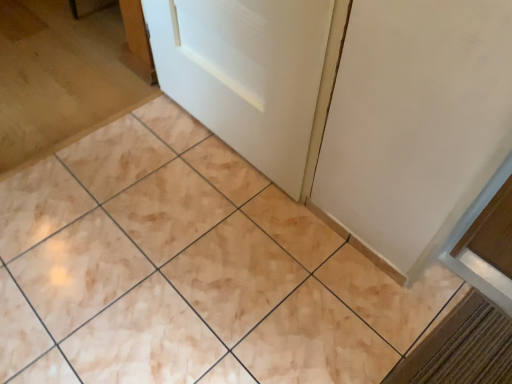
What is the approximate width of white glossy door at upper center?

The width of white glossy door at upper center is 3.68 inches.

Measure the distance between white glossy door at upper center and camera.

A distance of 38.03 inches exists between white glossy door at upper center and camera.

This screenshot has width=512, height=384. What do you see at coordinates (246, 73) in the screenshot?
I see `white glossy door at upper center` at bounding box center [246, 73].

Locate an element on the screen. white glossy door at upper center is located at coordinates (246, 73).

The image size is (512, 384). I want to click on beige marble tile at center, so click(x=188, y=270).

The image size is (512, 384). What do you see at coordinates (188, 270) in the screenshot? I see `beige marble tile at center` at bounding box center [188, 270].

Identify the location of white glossy door at upper center. This screenshot has height=384, width=512. (246, 73).

Between beige marble tile at center and white glossy door at upper center, which one appears on the right side from the viewer's perspective?

beige marble tile at center.

In the image, is beige marble tile at center positioned in front of or behind white glossy door at upper center?

beige marble tile at center is in front of white glossy door at upper center.

Considering the points (200, 266) and (272, 135), which point is in front, point (200, 266) or point (272, 135)?

The point (200, 266) is closer.

From the image's perspective, between beige marble tile at center and white glossy door at upper center, who is located below?

beige marble tile at center, from the image's perspective.

From a real-world perspective, which is physically above, beige marble tile at center or white glossy door at upper center?

white glossy door at upper center is physically above.

Between beige marble tile at center and white glossy door at upper center, which one has smaller width?

Thinner between the two is white glossy door at upper center.

Between beige marble tile at center and white glossy door at upper center, which one has less height?

Standing shorter between the two is beige marble tile at center.

Who is smaller, beige marble tile at center or white glossy door at upper center?

white glossy door at upper center is smaller.

Can white glossy door at upper center be found inside beige marble tile at center?

That's incorrect, white glossy door at upper center is not inside beige marble tile at center.

Is beige marble tile at center beside white glossy door at upper center?

No, beige marble tile at center is not touching white glossy door at upper center.

Is beige marble tile at center oriented away from white glossy door at upper center?

beige marble tile at center does not have its back to white glossy door at upper center.

The width and height of the screenshot is (512, 384). I want to click on door above the beige marble tile at center (from a real-world perspective), so click(246, 73).

Which is more to the left, white glossy door at upper center or beige marble tile at center?

From the viewer's perspective, white glossy door at upper center appears more on the left side.

Between white glossy door at upper center and beige marble tile at center, which one is positioned behind?

white glossy door at upper center is behind.

Does point (162, 75) come closer to viewer compared to point (48, 343)?

No, (162, 75) is further to viewer.

From the image's perspective, is white glossy door at upper center located beneath beige marble tile at center?

Actually, white glossy door at upper center appears above beige marble tile at center in the image.

From a real-world perspective, is white glossy door at upper center physically above beige marble tile at center?

Yes, from a real-world perspective, white glossy door at upper center is on top of beige marble tile at center.

Can you confirm if white glossy door at upper center is wider than beige marble tile at center?

No.

Considering the sizes of objects white glossy door at upper center and beige marble tile at center in the image provided, who is shorter, white glossy door at upper center or beige marble tile at center?

beige marble tile at center.

In terms of size, does white glossy door at upper center appear bigger or smaller than beige marble tile at center?

white glossy door at upper center is smaller than beige marble tile at center.

Is beige marble tile at center a part of white glossy door at upper center?

No, white glossy door at upper center does not contain beige marble tile at center.

Is the surface of white glossy door at upper center in direct contact with beige marble tile at center?

No, white glossy door at upper center is not beside beige marble tile at center.

In the scene shown: Is white glossy door at upper center positioned with its back to beige marble tile at center?

No, white glossy door at upper center is not facing away from beige marble tile at center.

Based on the photo, what's the angular difference between white glossy door at upper center and beige marble tile at center's facing directions?

The angular difference between white glossy door at upper center and beige marble tile at center is 89.3 degrees.

How much distance is there between white glossy door at upper center and beige marble tile at center?

white glossy door at upper center is 44.86 centimeters away from beige marble tile at center.

The width and height of the screenshot is (512, 384). In the image, there is a beige marble tile at center. What are the coordinates of `door above it (from the image's perspective)` in the screenshot? It's located at (246, 73).

You are a GUI agent. You are given a task and a screenshot of the screen. Output one action in this format:
    pyautogui.click(x=<x>, y=<y>)
    Task: Click on the door behind the beige marble tile at center
    This screenshot has height=384, width=512.
    Given the screenshot: What is the action you would take?
    pyautogui.click(x=246, y=73)

I want to click on door to the left of beige marble tile at center, so click(x=246, y=73).